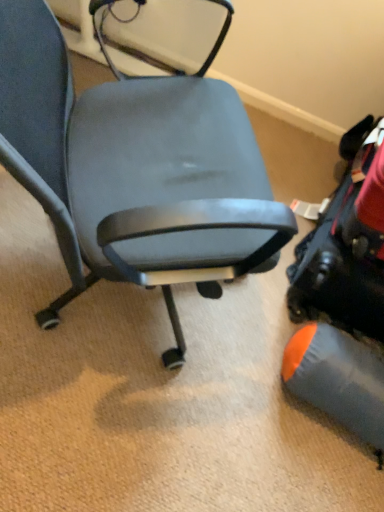
What do you see at coordinates (344, 296) in the screenshot?
I see `black rubber baby carriage at right` at bounding box center [344, 296].

Locate an element on the screen. This screenshot has height=512, width=384. black rubber baby carriage at right is located at coordinates (344, 296).

What is the approximate width of black rubber baby carriage at right?

16.65 inches.

The width and height of the screenshot is (384, 512). Identify the location of black rubber baby carriage at right. (344, 296).